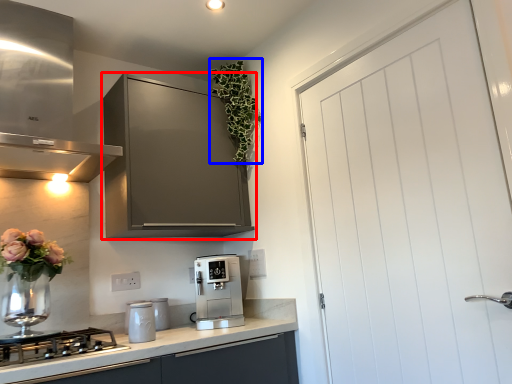
Question: Which of the following is the farthest to the observer, cabinetry (highlighted by a red box) or floral arrangement (highlighted by a blue box)?

Choices:
 (A) cabinetry
 (B) floral arrangement

Answer: (B)